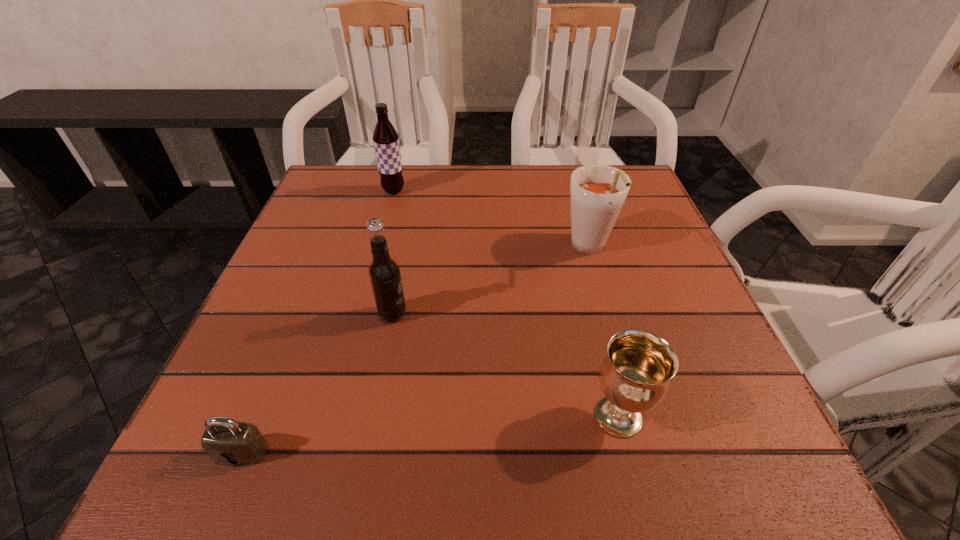
Identify the location of free point between the second root beer from right to left and the farthest root beer. (393, 253).

The image size is (960, 540). I want to click on vacant area that lies between the chalice and the second root beer from left to right, so coord(505,366).

At what (x,y) coordinates should I click in order to perform the action: click on vacant region between the fourth nearest object and the chalice. Please return your answer as a coordinate pair (x, y). The width and height of the screenshot is (960, 540). Looking at the image, I should click on (604, 333).

You are a GUI agent. You are given a task and a screenshot of the screen. Output one action in this format:
    pyautogui.click(x=<x>, y=<y>)
    Task: Click on the empty space between the second nearest root beer and the nearest root beer
    This screenshot has width=960, height=540.
    Given the screenshot: What is the action you would take?
    pyautogui.click(x=491, y=282)

Where is `vacant region between the leftmost object and the third object from left to right`? vacant region between the leftmost object and the third object from left to right is located at coordinates (317, 383).

I want to click on vacant point located between the nearest root beer and the leftmost root beer, so click(x=393, y=253).

Image resolution: width=960 pixels, height=540 pixels. What are the coordinates of `vacant area between the fourth tallest object and the leftmost object` in the screenshot? It's located at (430, 435).

I want to click on free area in between the second root beer from right to left and the leftmost root beer, so click(x=393, y=253).

Identify the location of empty space that is in between the padlock and the third object from right to left. (317, 383).

The height and width of the screenshot is (540, 960). In order to click on object that stands as the third closest to the second nearest root beer in this screenshot , I will do `click(386, 139)`.